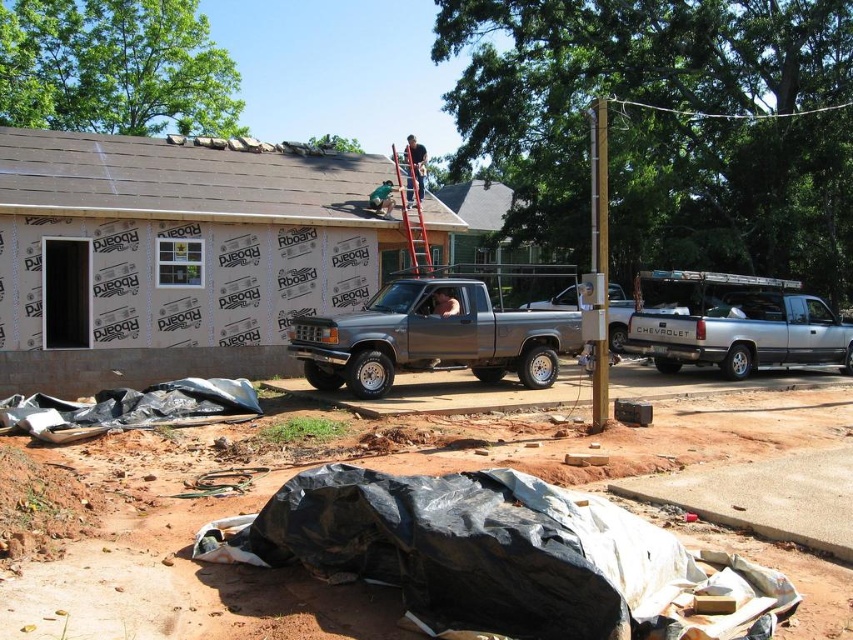
Question: Which object appears farthest from the camera in this image?

Choices:
 (A) matte black shirt at upper center
 (B) wooden ladder at center
 (C) silver metallic truck at right
 (D) gray metallic truck at center

Answer: (A)

Question: Does gray metallic truck at center come in front of silver metallic truck at right?

Choices:
 (A) yes
 (B) no

Answer: (A)

Question: Estimate the real-world distances between objects in this image. Which object is closer to the wooden ladder at center?

Choices:
 (A) gray metallic truck at center
 (B) matte black shirt at upper center
 (C) silver metallic truck at right

Answer: (B)

Question: Which is farther from the matte black shirt at upper center?

Choices:
 (A) wooden ladder at center
 (B) silver metallic truck at right
 (C) gray metallic truck at center

Answer: (C)

Question: Is gray metallic truck at center below wooden ladder at center?

Choices:
 (A) no
 (B) yes

Answer: (B)

Question: Does wooden ladder at center lie behind matte black shirt at upper center?

Choices:
 (A) no
 (B) yes

Answer: (A)